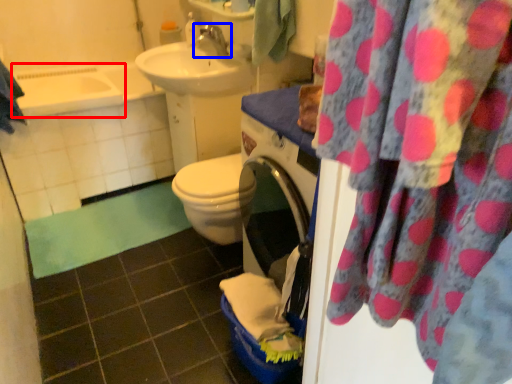
Question: Which point is closer to the camera, bath (highlighted by a red box) or tap (highlighted by a blue box)?

Choices:
 (A) bath
 (B) tap

Answer: (B)